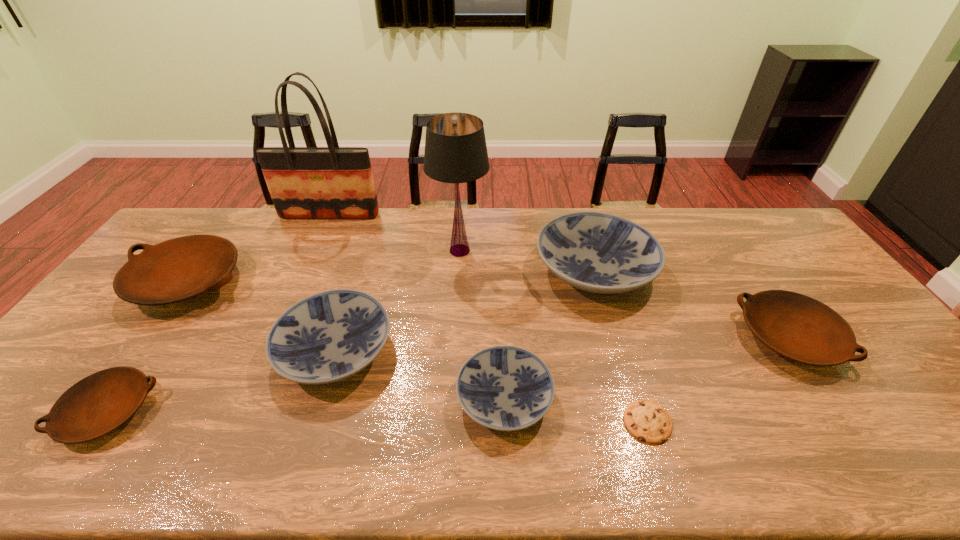
Identify the location of vacant space that is in between the biggest brown plate and the shortest plate. The image size is (960, 540). (x=148, y=347).

Locate which object ranks fourth in proximity to the third plate from right to left. Please provide its 2D coordinates. Your answer should be formatted as a tuple, i.e. [(x, y)], where the tuple contains the x and y coordinates of a point satisfying the conditions above.

[(455, 151)]

Locate which object ranks fourth in proximity to the second shortest object. Please provide its 2D coordinates. Your answer should be formatted as a tuple, i.e. [(x, y)], where the tuple contains the x and y coordinates of a point satisfying the conditions above.

[(506, 388)]

Find the location of a particular element. This screenshot has height=540, width=960. plate that is the second closest to the shortest object is located at coordinates (800, 328).

Select which plate is the fourth closest to the lampshade. Please provide its 2D coordinates. Your answer should be formatted as a tuple, i.e. [(x, y)], where the tuple contains the x and y coordinates of a point satisfying the conditions above.

[(178, 269)]

The width and height of the screenshot is (960, 540). Identify the location of blue plate that is the closest to the lampshade. (596, 252).

Image resolution: width=960 pixels, height=540 pixels. In order to click on blue plate that is the nearest to the fifth plate from left to right in this screenshot , I will do `click(506, 388)`.

At what (x,y) coordinates should I click in order to perform the action: click on brown plate that is the closest to the biggest brown plate. Please return your answer as a coordinate pair (x, y). Looking at the image, I should click on (100, 403).

Point out which brown plate is positioned as the nearest to the second blue plate from right to left. Please provide its 2D coordinates. Your answer should be formatted as a tuple, i.e. [(x, y)], where the tuple contains the x and y coordinates of a point satisfying the conditions above.

[(800, 328)]

What are the coordinates of `vacant area that satisfies the following two spatial constraints: 1. on the front-facing side of the rightmost brown plate; 2. on the right side of the lampshade` in the screenshot? It's located at (455, 338).